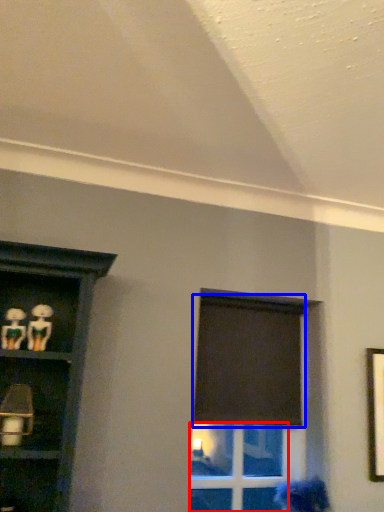
Question: Among these objects, which one is farthest to the camera, glass door (highlighted by a red box) or curtain (highlighted by a blue box)?

Choices:
 (A) glass door
 (B) curtain

Answer: (B)